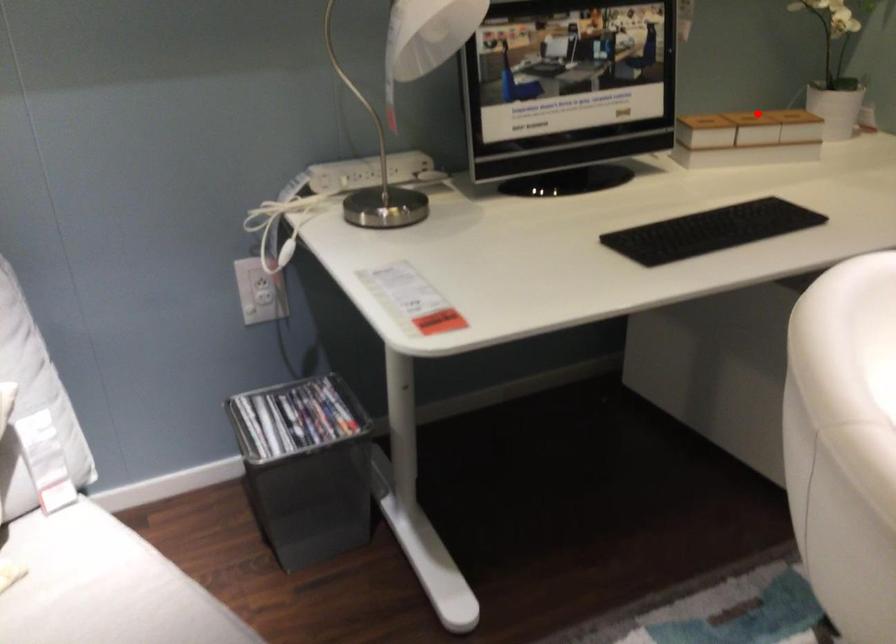
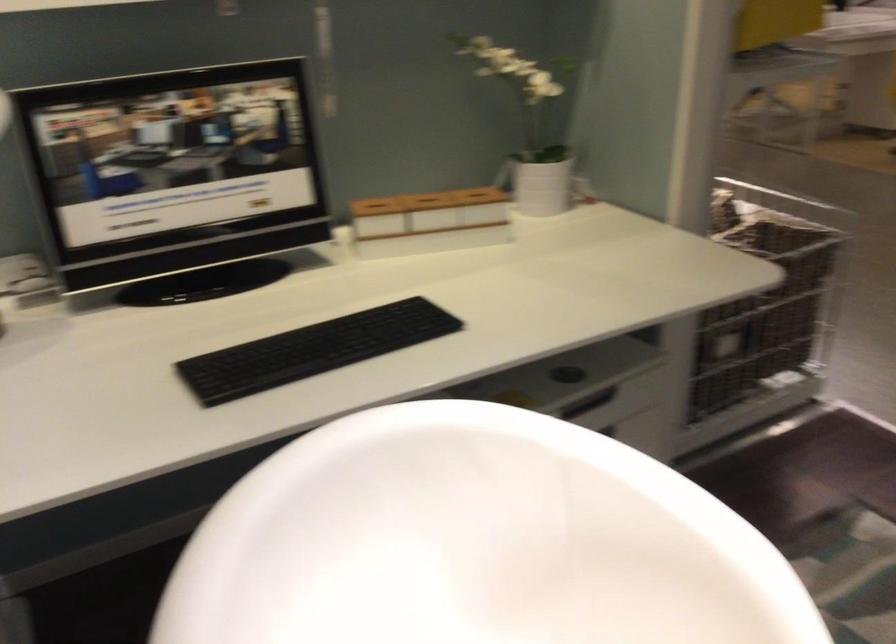
Where in the second image is the point corresponding to the highlighted location from the first image?

(426, 198)